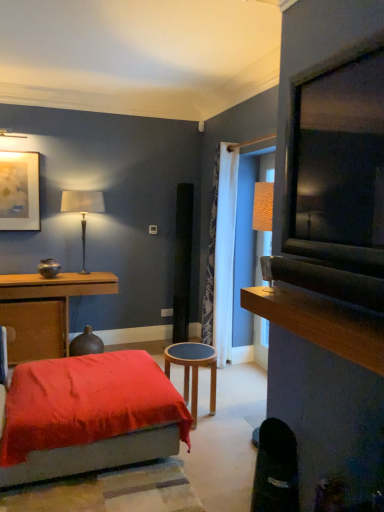
What is the approximate width of metallic gold table lamp at upper left?

The width of metallic gold table lamp at upper left is 10.04 inches.

Locate an element on the screen. The image size is (384, 512). white textured curtain at center is located at coordinates (221, 254).

Describe the element at coordinates (221, 254) in the screenshot. This screenshot has width=384, height=512. I see `white textured curtain at center` at that location.

What is the approximate height of wooden table at left, arranged as the first table when viewed from the left?

The height of wooden table at left, arranged as the first table when viewed from the left, is 33.47 inches.

The width and height of the screenshot is (384, 512). In order to click on velvet red ottoman at lower left in this screenshot , I will do `click(89, 416)`.

Is velvet red ottoman at lower left not close to wooden table at left, which appears as the first table when viewed from the back?

Yes, velvet red ottoman at lower left and wooden table at left, which appears as the first table when viewed from the back, are quite far apart.

Looking at this image, from the image's perspective, which object appears higher, velvet red ottoman at lower left or wooden table at left, arranged as the first table when viewed from the left?

wooden table at left, arranged as the first table when viewed from the left.

The width and height of the screenshot is (384, 512). In order to click on bed in front of the wooden table at left, which appears as the first table when viewed from the back in this screenshot , I will do `click(89, 416)`.

Is velvet red ottoman at lower left surrounding wooden table at left, arranged as the first table when viewed from the left?

Actually, wooden table at left, arranged as the first table when viewed from the left, is outside velvet red ottoman at lower left.

Is metallic gold table lamp at upper left aimed at matte gold picture frame at upper left?

No, metallic gold table lamp at upper left is not facing towards matte gold picture frame at upper left.

Considering the points (94, 203) and (9, 160), which point is in front, point (94, 203) or point (9, 160)?

Positioned in front is point (9, 160).

Is the surface of metallic gold table lamp at upper left in direct contact with matte gold picture frame at upper left?

No, metallic gold table lamp at upper left is not beside matte gold picture frame at upper left.

Is metallic gold table lamp at upper left positioned behind matte gold picture frame at upper left?

Yes.

Considering their positions, is wooden stool at center, arranged as the 2th table when viewed from the back, located in front of or behind white textured curtain at center?

wooden stool at center, arranged as the 2th table when viewed from the back, is in front of white textured curtain at center.

Find the location of `the 1st table to the left of the white textured curtain at center, starting your count from the anchor`. the 1st table to the left of the white textured curtain at center, starting your count from the anchor is located at coordinates (193, 370).

Between wooden stool at center, positioned as the 1th table in right-to-left order, and white textured curtain at center, which one has larger size?

Bigger between the two is white textured curtain at center.

From the image's perspective, between wooden table at left, positioned as the 2th table in front-to-back order, and matte gold picture frame at upper left, which one is located above?

matte gold picture frame at upper left.

Visually, is wooden table at left, which appears as the first table when viewed from the back, positioned to the left or to the right of matte gold picture frame at upper left?

In the image, wooden table at left, which appears as the first table when viewed from the back, appears on the right side of matte gold picture frame at upper left.

Is wooden table at left, arranged as the first table when viewed from the left, smaller than matte gold picture frame at upper left?

Actually, wooden table at left, arranged as the first table when viewed from the left, might be larger than matte gold picture frame at upper left.

From a real-world perspective, between wooden table at left, which appears as the first table when viewed from the back, and matte gold picture frame at upper left, who is vertically higher?

In real-world perspective, matte gold picture frame at upper left is above.

Is velvet red ottoman at lower left shorter than black leather swivel chair at lower right?

Indeed, velvet red ottoman at lower left has a lesser height compared to black leather swivel chair at lower right.

Can you see velvet red ottoman at lower left touching black leather swivel chair at lower right?

velvet red ottoman at lower left and black leather swivel chair at lower right are clearly separated.

Is velvet red ottoman at lower left aimed at black leather swivel chair at lower right?

Yes, velvet red ottoman at lower left is aimed at black leather swivel chair at lower right.

I want to click on curtain that appears above the velvet red ottoman at lower left (from the image's perspective), so click(x=221, y=254).

Is white textured curtain at center not near velvet red ottoman at lower left?

That's right, there is a large distance between white textured curtain at center and velvet red ottoman at lower left.

Does white textured curtain at center appear on the right side of velvet red ottoman at lower left?

Yes, white textured curtain at center is to the right of velvet red ottoman at lower left.

Is point (204, 303) behind point (31, 440)?

Yes.

Find the location of `picture frame in front of the metallic gold table lamp at upper left`. picture frame in front of the metallic gold table lamp at upper left is located at coordinates (19, 191).

Which is more to the right, matte gold picture frame at upper left or metallic gold table lamp at upper left?

From the viewer's perspective, metallic gold table lamp at upper left appears more on the right side.

Can you confirm if matte gold picture frame at upper left is thinner than metallic gold table lamp at upper left?

Correct, the width of matte gold picture frame at upper left is less than that of metallic gold table lamp at upper left.

From their relative heights in the image, would you say matte gold picture frame at upper left is taller or shorter than metallic gold table lamp at upper left?

Clearly, matte gold picture frame at upper left is shorter compared to metallic gold table lamp at upper left.

Locate an element on the screen. The image size is (384, 512). bed below the wooden table at left, positioned as the 2th table in right-to-left order (from the image's perspective) is located at coordinates (89, 416).

You are a GUI agent. You are given a task and a screenshot of the screen. Output one action in this format:
    pyautogui.click(x=<x>, y=<y>)
    Task: Click on the picture frame on the left of metallic gold table lamp at upper left
    
    Given the screenshot: What is the action you would take?
    pyautogui.click(x=19, y=191)

Which object lies nearer to the anchor point velvet red ottoman at lower left, black leather swivel chair at lower right or metallic gold table lamp at upper left?

black leather swivel chair at lower right.

Considering their positions, is metallic gold table lamp at upper left positioned closer to white textured curtain at center than velvet red ottoman at lower left?

metallic gold table lamp at upper left is closer to white textured curtain at center.

Which object lies further to the anchor point wooden stool at center, which is the second table from left to right, white textured curtain at center or wooden table at left, which appears as the first table when viewed from the back?

Based on the image, wooden table at left, which appears as the first table when viewed from the back, appears to be further to wooden stool at center, which is the second table from left to right.

Based on their spatial positions, is velvet red ottoman at lower left or metallic gold table lamp at upper left further from white textured curtain at center?

Based on the image, velvet red ottoman at lower left appears to be further to white textured curtain at center.

Considering their positions, is matte gold picture frame at upper left positioned closer to metallic gold table lamp at upper left than black leather swivel chair at lower right?

The object closer to metallic gold table lamp at upper left is matte gold picture frame at upper left.

Based on their spatial positions, is white textured curtain at center or wooden stool at center, positioned as the 1th table in right-to-left order, closer to velvet red ottoman at lower left?

wooden stool at center, positioned as the 1th table in right-to-left order, lies closer to velvet red ottoman at lower left than the other object.

Looking at the image, which one is located further to velvet red ottoman at lower left, wooden table at left, positioned as the 2th table in front-to-back order, or metallic gold table lamp at upper left?

The object further to velvet red ottoman at lower left is metallic gold table lamp at upper left.

Considering their positions, is white textured curtain at center positioned closer to matte gold picture frame at upper left than metallic gold table lamp at upper left?

metallic gold table lamp at upper left.

Image resolution: width=384 pixels, height=512 pixels. Find the location of `curtain located between velvet red ottoman at lower left and metallic gold table lamp at upper left in the depth direction`. curtain located between velvet red ottoman at lower left and metallic gold table lamp at upper left in the depth direction is located at coordinates (221, 254).

Locate an element on the screen. This screenshot has width=384, height=512. table between black leather swivel chair at lower right and white textured curtain at center in the front-back direction is located at coordinates click(x=193, y=370).

The width and height of the screenshot is (384, 512). I want to click on bed between black leather swivel chair at lower right and metallic gold table lamp at upper left in the front-back direction, so [89, 416].

At what (x,y) coordinates should I click in order to perform the action: click on table lamp between wooden table at left, positioned as the 2th table in front-to-back order, and white textured curtain at center from left to right. Please return your answer as a coordinate pair (x, y). Looking at the image, I should click on (82, 210).